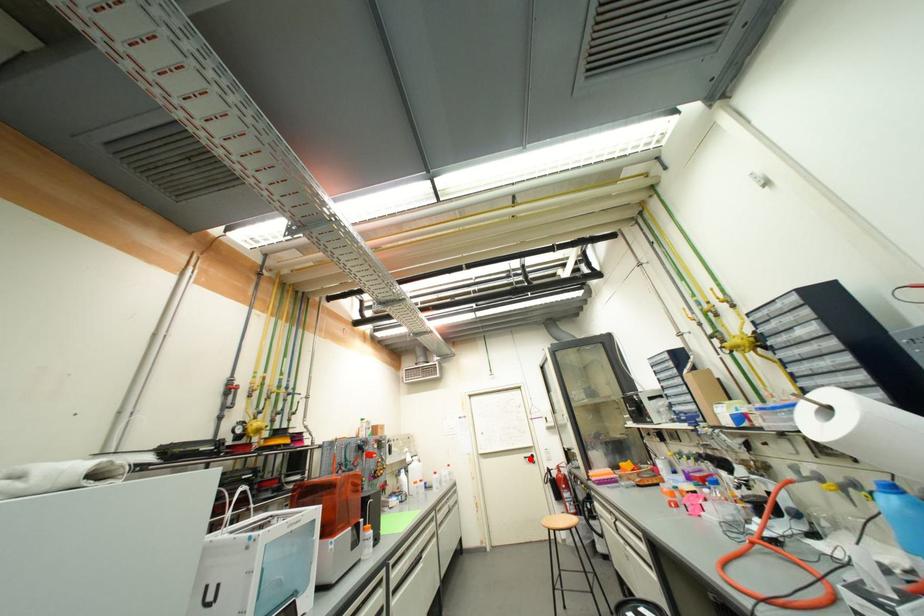
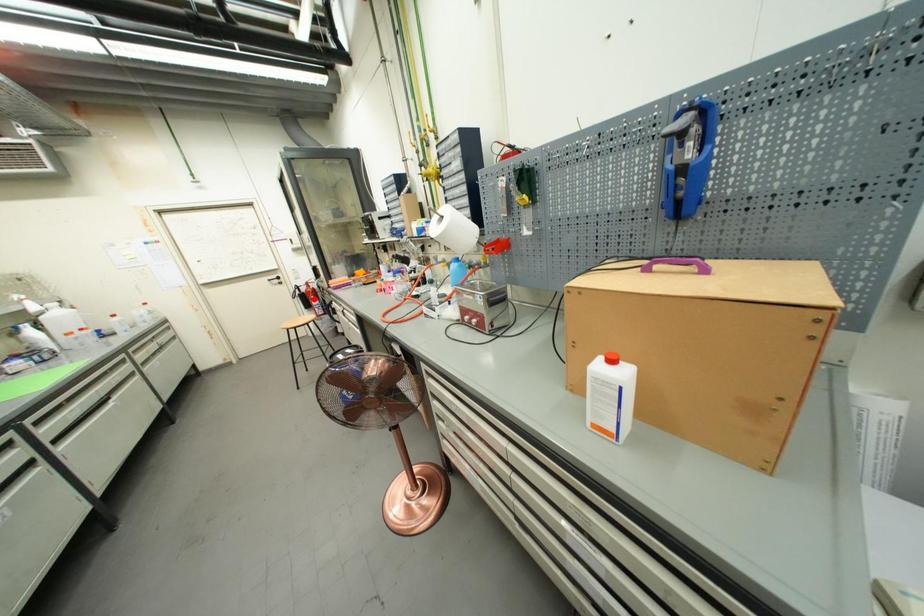
I am providing you with two images of the same scene from different viewpoints. A red point is marked on the first image and another point is marked on the second image. Does the point marked in image1 correspond to the same location as the one in image2?

No